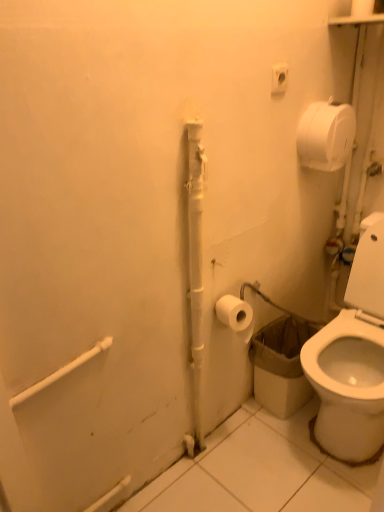
Question: Does white matte toilet paper at lower right, positioned as the second toilet paper in top-to-bottom order, have a lesser width compared to white plastic outlet at upper center?

Choices:
 (A) yes
 (B) no

Answer: (B)

Question: From the image's perspective, is white matte toilet paper at lower right, the first toilet paper from the bottom, over white plastic outlet at upper center?

Choices:
 (A) yes
 (B) no

Answer: (B)

Question: Is white matte toilet paper at lower right, positioned as the second toilet paper in top-to-bottom order, next to white plastic outlet at upper center?

Choices:
 (A) no
 (B) yes

Answer: (A)

Question: Does white matte toilet paper at lower right, the first toilet paper from the bottom, have a lesser height compared to white plastic outlet at upper center?

Choices:
 (A) yes
 (B) no

Answer: (B)

Question: Is white matte toilet paper at lower right, arranged as the first toilet paper when viewed from the left, taller than white plastic outlet at upper center?

Choices:
 (A) no
 (B) yes

Answer: (B)

Question: From their relative heights in the image, would you say white matte toilet paper at upper right, positioned as the first toilet paper in top-to-bottom order, is taller or shorter than white matte toilet paper at lower right, positioned as the second toilet paper in top-to-bottom order?

Choices:
 (A) short
 (B) tall

Answer: (B)

Question: In the image, is white matte toilet paper at upper right, the first toilet paper positioned from the right, on the left side or the right side of white matte toilet paper at lower right, which is counted as the 2th toilet paper, starting from the right?

Choices:
 (A) left
 (B) right

Answer: (B)

Question: From the image's perspective, is white matte toilet paper at upper right, the first toilet paper positioned from the right, located above or below white matte toilet paper at lower right, arranged as the first toilet paper when viewed from the left?

Choices:
 (A) above
 (B) below

Answer: (A)

Question: Is white matte toilet paper at upper right, positioned as the first toilet paper in top-to-bottom order, bigger or smaller than white matte toilet paper at lower right, which is counted as the 2th toilet paper, starting from the right?

Choices:
 (A) big
 (B) small

Answer: (A)

Question: Considering the relative positions of white matte toilet paper at lower right, positioned as the second toilet paper in top-to-bottom order, and white matte toilet paper at upper right, positioned as the first toilet paper in top-to-bottom order, in the image provided, is white matte toilet paper at lower right, positioned as the second toilet paper in top-to-bottom order, to the left or to the right of white matte toilet paper at upper right, positioned as the first toilet paper in top-to-bottom order,?

Choices:
 (A) left
 (B) right

Answer: (A)

Question: Considering the positions of white matte toilet paper at lower right, the first toilet paper from the bottom, and white matte toilet paper at upper right, which is the 2th toilet paper in left-to-right order, in the image, is white matte toilet paper at lower right, the first toilet paper from the bottom, wider or thinner than white matte toilet paper at upper right, which is the 2th toilet paper in left-to-right order,?

Choices:
 (A) thin
 (B) wide

Answer: (B)

Question: Is white matte toilet paper at lower right, which is counted as the 2th toilet paper, starting from the right, taller or shorter than white matte toilet paper at upper right, positioned as the first toilet paper in top-to-bottom order?

Choices:
 (A) short
 (B) tall

Answer: (A)

Question: Considering the positions of point (220, 312) and point (311, 150), is point (220, 312) closer or farther from the camera than point (311, 150)?

Choices:
 (A) closer
 (B) farther

Answer: (A)

Question: From their relative heights in the image, would you say white plastic outlet at upper center is taller or shorter than white matte toilet paper at upper right, the first toilet paper positioned from the right?

Choices:
 (A) tall
 (B) short

Answer: (B)

Question: In the image, is white plastic outlet at upper center positioned in front of or behind white matte toilet paper at upper right, positioned as the first toilet paper in top-to-bottom order?

Choices:
 (A) behind
 (B) front

Answer: (B)